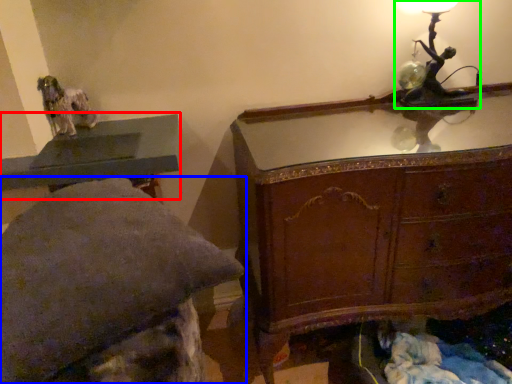
Question: Which object is the closest to the table (highlighted by a red box)? Choose among these: furniture (highlighted by a blue box) or table lamp (highlighted by a green box).

Choices:
 (A) furniture
 (B) table lamp

Answer: (A)